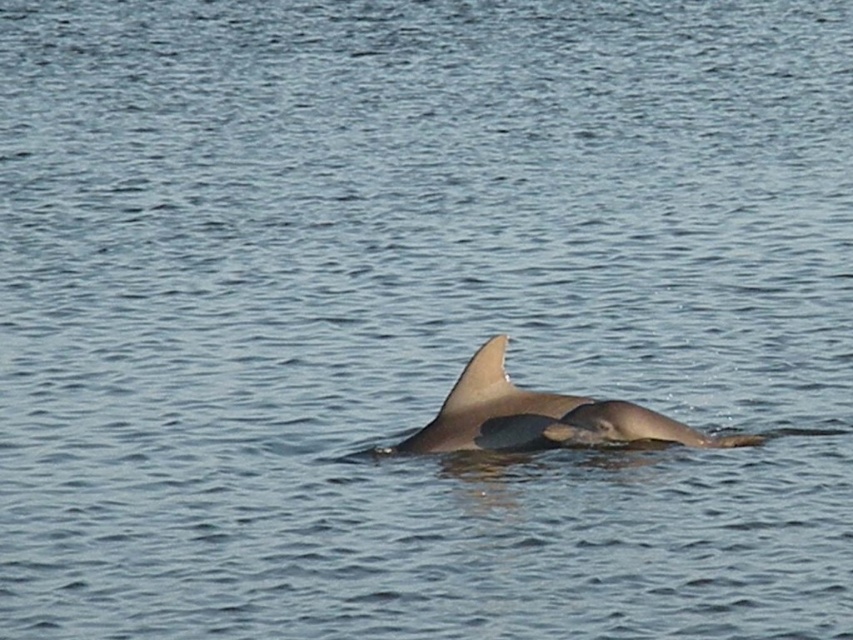
Question: Is smooth gray dolphin at center further to camera compared to smooth gray fin at center?

Choices:
 (A) no
 (B) yes

Answer: (A)

Question: Among these objects, which one is farthest from the camera?

Choices:
 (A) smooth gray fin at center
 (B) smooth gray dolphin at center

Answer: (A)

Question: Where is smooth gray dolphin at center located in relation to smooth gray fin at center in the image?

Choices:
 (A) left
 (B) right

Answer: (B)

Question: Which point is farther to the camera?

Choices:
 (A) (486, 401)
 (B) (463, 378)

Answer: (A)

Question: Which point is farther from the camera taking this photo?

Choices:
 (A) (558, 406)
 (B) (474, 380)

Answer: (A)

Question: Can you confirm if smooth gray dolphin at center is thinner than smooth gray fin at center?

Choices:
 (A) no
 (B) yes

Answer: (A)